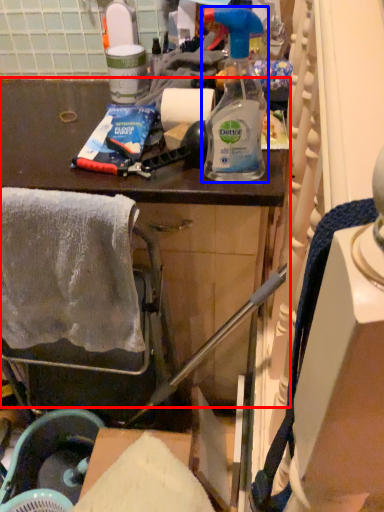
Question: Which point is closer to the camera, cabinetry (highlighted by a red box) or bottle (highlighted by a blue box)?

Choices:
 (A) cabinetry
 (B) bottle

Answer: (B)